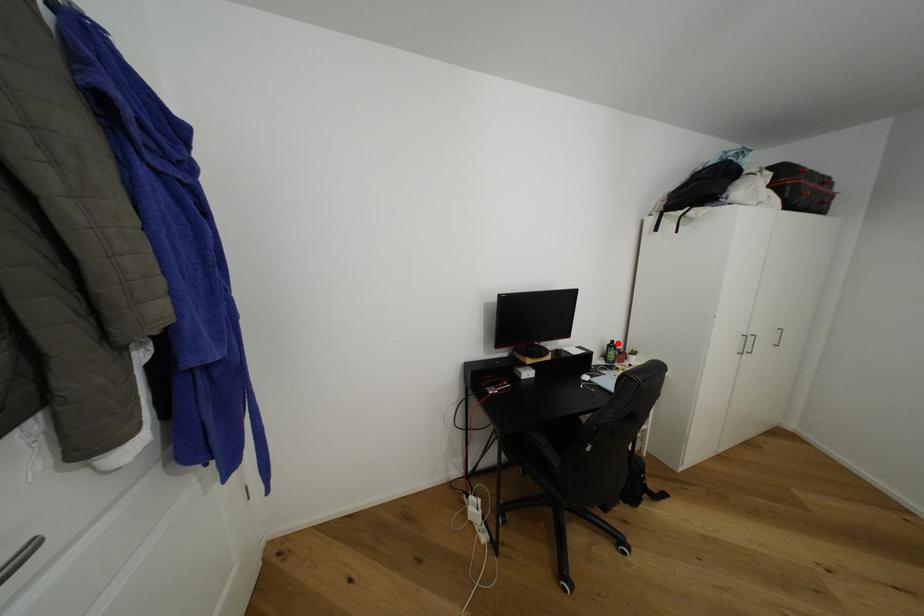
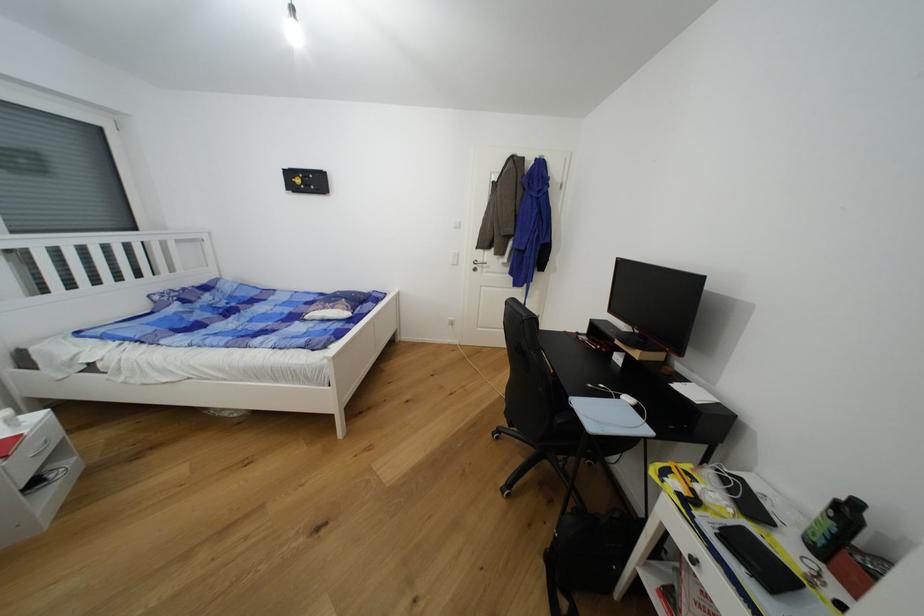
Question: I am providing you with two images of the same scene from different viewpoints. A red point is shown in image1. For the corresponding object point in image2, is it positioned nearer or farther from the camera?

Choices:
 (A) Nearer
 (B) Farther

Answer: (A)